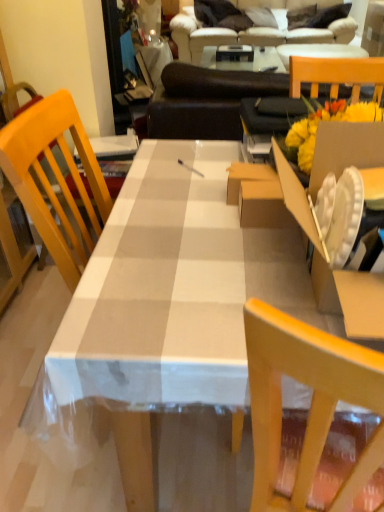
Question: Considering the relative positions of white checkered tablecloth at center and wooden chair at right in the image provided, is white checkered tablecloth at center to the right of wooden chair at right from the viewer's perspective?

Choices:
 (A) yes
 (B) no

Answer: (B)

Question: From a real-world perspective, is white checkered tablecloth at center beneath wooden chair at right?

Choices:
 (A) yes
 (B) no

Answer: (A)

Question: From the image's perspective, is white checkered tablecloth at center beneath wooden chair at right?

Choices:
 (A) yes
 (B) no

Answer: (A)

Question: Would you say white checkered tablecloth at center contains wooden chair at right?

Choices:
 (A) yes
 (B) no

Answer: (B)

Question: Is white checkered tablecloth at center thinner than wooden chair at right?

Choices:
 (A) yes
 (B) no

Answer: (B)

Question: Would you say cardboard box at right is to the left or to the right of beige fabric couch at upper center in the picture?

Choices:
 (A) left
 (B) right

Answer: (A)

Question: In the image, is cardboard box at right positioned in front of or behind beige fabric couch at upper center?

Choices:
 (A) front
 (B) behind

Answer: (A)

Question: Considering the positions of cardboard box at right and beige fabric couch at upper center in the image, is cardboard box at right wider or thinner than beige fabric couch at upper center?

Choices:
 (A) wide
 (B) thin

Answer: (B)

Question: From the image's perspective, is cardboard box at right above or below beige fabric couch at upper center?

Choices:
 (A) above
 (B) below

Answer: (B)

Question: Is point (114, 347) closer or farther from the camera than point (314, 165)?

Choices:
 (A) farther
 (B) closer

Answer: (B)

Question: Is white checkered tablecloth at center spatially inside cardboard box at right, or outside of it?

Choices:
 (A) outside
 (B) inside

Answer: (A)

Question: From their relative heights in the image, would you say white checkered tablecloth at center is taller or shorter than cardboard box at right?

Choices:
 (A) short
 (B) tall

Answer: (B)

Question: Relative to cardboard box at right, is white checkered tablecloth at center in front or behind?

Choices:
 (A) behind
 (B) front

Answer: (A)

Question: Do you think beige fabric couch at upper center is within white checkered tablecloth at center, or outside of it?

Choices:
 (A) outside
 (B) inside

Answer: (A)

Question: Is point (195, 30) positioned closer to the camera than point (115, 223)?

Choices:
 (A) farther
 (B) closer

Answer: (A)